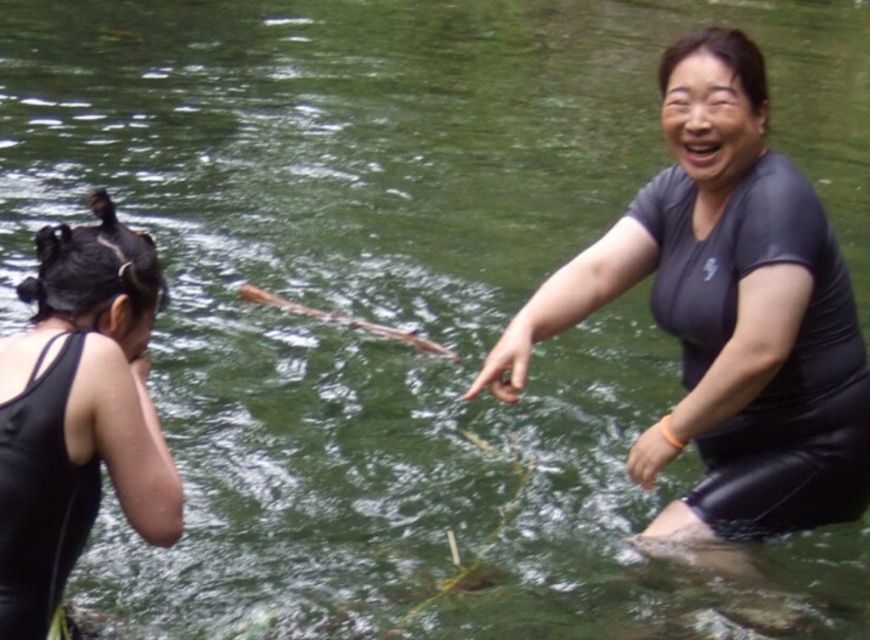
You are a lifeguard observing the scene. You need to determine which swimmer is more submerged in the water. Based on the objects provided, which one is larger and thus might require more space? The black matte swimsuit at center and the black matte wetsuit at right are both in the water.

The black matte swimsuit at center is larger than the black matte wetsuit at right, so it might require more space in the water.

You are a photographer positioned at the edge of the water. You want to take a photo that includes both the black matte swimsuit at center and the black matte wetsuit at right. Which object should you adjust your camera focus on first to ensure both are in the frame?

The black matte swimsuit at center is closer to the photographer than the black matte wetsuit at right. To ensure both are in focus, adjust the camera focus on the black matte swimsuit at center first, then the black matte wetsuit at right.